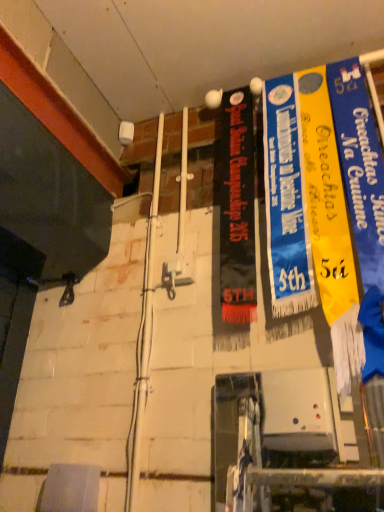
Question: Is blue fabric banner at center, the first poster from the left, in contact with yellow fabric banner at right, which is counted as the second poster, starting from the left?

Choices:
 (A) yes
 (B) no

Answer: (A)

Question: Is blue fabric banner at center, the first poster from the left, far from yellow fabric banner at right, which is counted as the second poster, starting from the left?

Choices:
 (A) no
 (B) yes

Answer: (A)

Question: Does blue fabric banner at center, the first poster from the left, have a smaller size compared to yellow fabric banner at right, the 1th poster positioned from the right?

Choices:
 (A) yes
 (B) no

Answer: (A)

Question: Considering the relative sizes of blue fabric banner at center, the first poster from the left, and yellow fabric banner at right, the 1th poster positioned from the right, in the image provided, is blue fabric banner at center, the first poster from the left, wider than yellow fabric banner at right, the 1th poster positioned from the right,?

Choices:
 (A) no
 (B) yes

Answer: (A)

Question: Is blue fabric banner at center, the first poster from the left, aimed at yellow fabric banner at right, which is counted as the second poster, starting from the left?

Choices:
 (A) no
 (B) yes

Answer: (A)

Question: From the image's perspective, would you say blue fabric banner at center, the 2th poster when ordered from right to left, is positioned over yellow fabric banner at right, which is counted as the second poster, starting from the left?

Choices:
 (A) no
 (B) yes

Answer: (B)

Question: Is yellow fabric banner at right, the 1th poster positioned from the right, at the left side of blue fabric banner at center, the first poster from the left?

Choices:
 (A) yes
 (B) no

Answer: (B)

Question: From the image's perspective, is yellow fabric banner at right, which is counted as the second poster, starting from the left, over blue fabric banner at center, the 2th poster when ordered from right to left?

Choices:
 (A) yes
 (B) no

Answer: (B)

Question: Is yellow fabric banner at right, which is counted as the second poster, starting from the left, outside of blue fabric banner at center, the first poster from the left?

Choices:
 (A) no
 (B) yes

Answer: (B)

Question: Is yellow fabric banner at right, which is counted as the second poster, starting from the left, far from blue fabric banner at center, the first poster from the left?

Choices:
 (A) yes
 (B) no

Answer: (B)

Question: Does yellow fabric banner at right, which is counted as the second poster, starting from the left, have a lesser height compared to blue fabric banner at center, the 2th poster when ordered from right to left?

Choices:
 (A) yes
 (B) no

Answer: (B)

Question: Considering the relative sizes of yellow fabric banner at right, the 1th poster positioned from the right, and blue fabric banner at center, the first poster from the left, in the image provided, is yellow fabric banner at right, the 1th poster positioned from the right, bigger than blue fabric banner at center, the first poster from the left,?

Choices:
 (A) no
 (B) yes

Answer: (B)

Question: From the image's perspective, is blue fabric banner at center, the first poster from the left, above or below yellow fabric banner at right, which is counted as the second poster, starting from the left?

Choices:
 (A) below
 (B) above

Answer: (B)